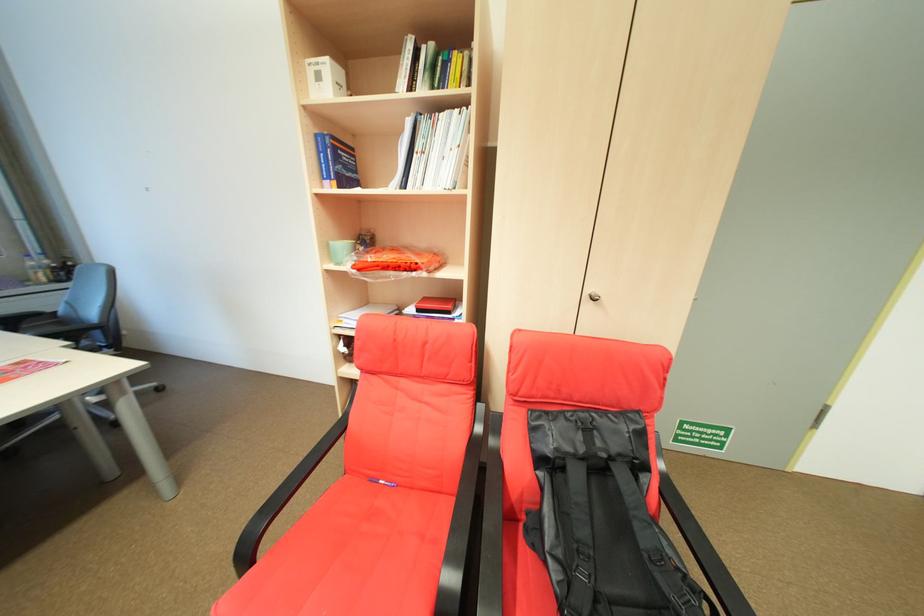
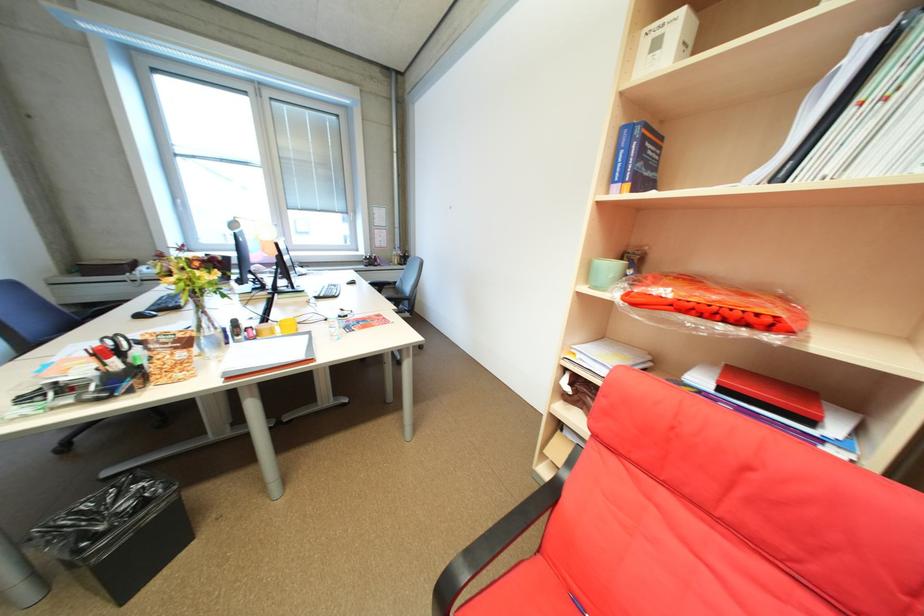
Question: How did the camera likely rotate?

Choices:
 (A) Left
 (B) Right
 (C) Up
 (D) Down

Answer: (A)